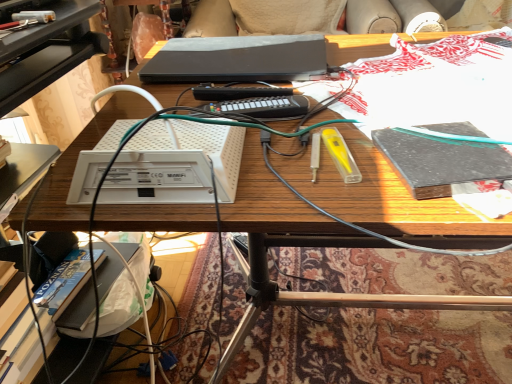
The image size is (512, 384). Identify the location of vacant space in between white plastic router at center and black matte book at right. (307, 172).